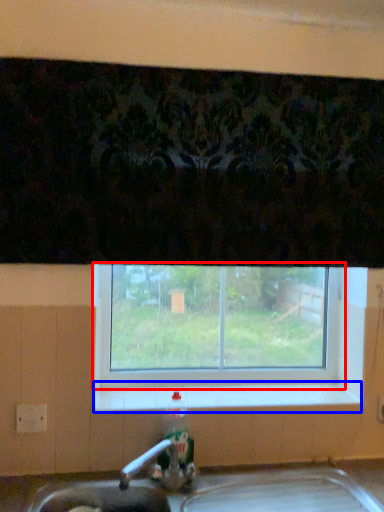
Question: Which object appears farthest to the camera in this image, window (highlighted by a red box) or window sill (highlighted by a blue box)?

Choices:
 (A) window
 (B) window sill

Answer: (A)